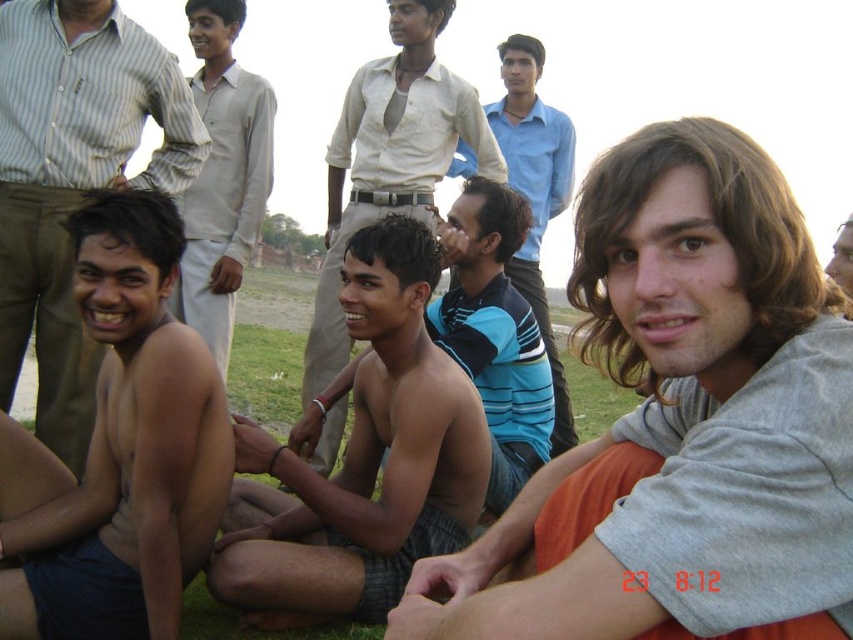
What is located at the coordinates point (680, 424)?

The point (680, 424) indicates the location of the gray cotton shirt at center.

You are planning to take a photo of the smooth skin man at center and the blue striped shirt at center. Since you want both subjects to be clearly visible in the frame, which subject should you focus on to ensure the one taking up more space is in focus?

You should focus on the blue striped shirt at center because it occupies more space than the smooth skin man at center, so focusing on the larger subject ensures both will be in focus.